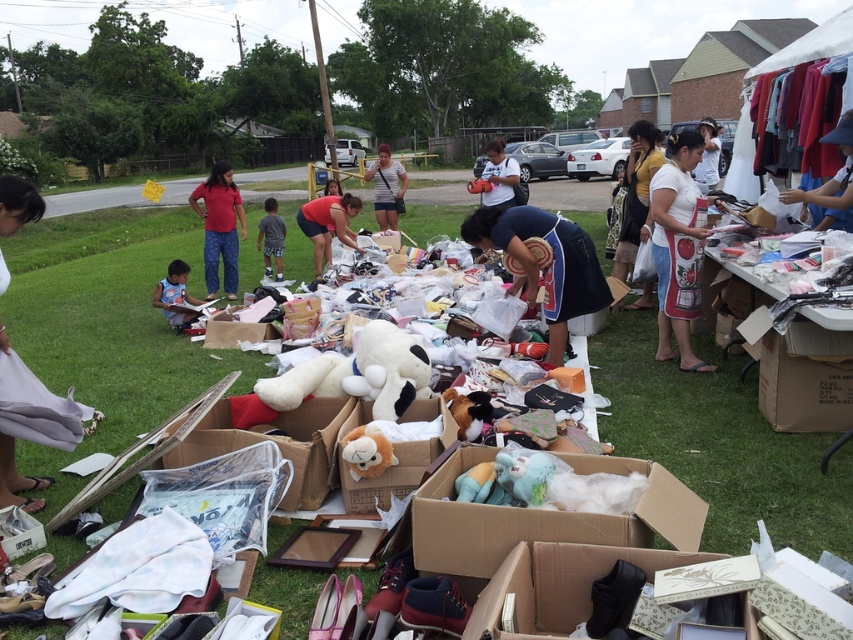
Question: In this image, where is matte black shirt at upper right located relative to matte white shirt at upper right?

Choices:
 (A) above
 (B) below

Answer: (B)

Question: Which object appears farthest from the camera in this image?

Choices:
 (A) matte black shirt at upper right
 (B) white fluffy stuffed toys at center
 (C) white cotton shirt at center
 (D) brown plush toy at center

Answer: (C)

Question: Among these points, which one is farthest from the camera?

Choices:
 (A) (514, 184)
 (B) (675, 355)
 (C) (369, 356)

Answer: (A)

Question: Is fluffy plush toy at center bigger than brown plush toy at center?

Choices:
 (A) yes
 (B) no

Answer: (A)

Question: Can you confirm if white plush toy at center is positioned above matte black shirt at upper right?

Choices:
 (A) no
 (B) yes

Answer: (A)

Question: Among these points, which one is nearest to the camera?

Choices:
 (A) (715, 125)
 (B) (366, 388)

Answer: (B)